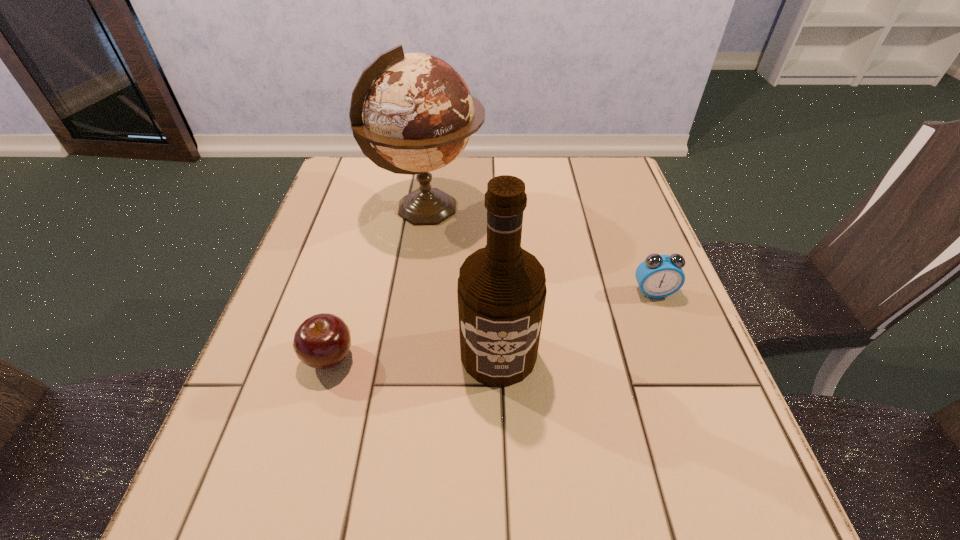
Find the location of a particular element. The image size is (960, 540). the farthest object is located at coordinates (416, 110).

Where is `alcohol`? alcohol is located at coordinates (501, 290).

Locate an element on the screen. alarm clock is located at coordinates (658, 276).

Where is `the third nearest object`? The height and width of the screenshot is (540, 960). the third nearest object is located at coordinates click(658, 276).

You are a GUI agent. You are given a task and a screenshot of the screen. Output one action in this format:
    pyautogui.click(x=<x>, y=<y>)
    Task: Click on the apple
    The image size is (960, 540).
    Given the screenshot: What is the action you would take?
    [x=322, y=341]

Identify the location of vacant area located 0.320m on the front of the farthest object showing Asia. (608, 209).

The width and height of the screenshot is (960, 540). Identify the location of free location located 0.210m on the label of the alcohol. (504, 517).

Locate an element on the screen. This screenshot has height=540, width=960. vacant space located 0.080m on the face of the alarm clock is located at coordinates (668, 329).

This screenshot has height=540, width=960. Identify the location of free space located 0.230m on the back of the apple. (359, 256).

Locate an element on the screen. The height and width of the screenshot is (540, 960). object situated at the far edge is located at coordinates (x=416, y=110).